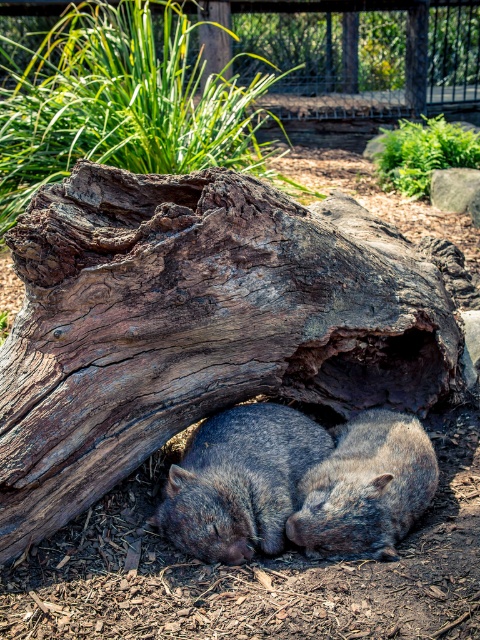
Consider the image. Measure the distance between fuzzy gray wombat at center and gray furry wombat at center.

fuzzy gray wombat at center is 10.03 inches away from gray furry wombat at center.

Between fuzzy gray wombat at center and gray furry wombat at center, which one has less height?

With less height is gray furry wombat at center.

Who is more distant from viewer, (173, 493) or (355, 468)?

The point (355, 468) is behind.

Where is `fuzzy gray wombat at center`? The image size is (480, 640). fuzzy gray wombat at center is located at coordinates (240, 481).

Who is more distant from viewer, (444,289) or (288,429)?

Point (444,289)

You are a GUI agent. You are given a task and a screenshot of the screen. Output one action in this format:
    pyautogui.click(x=<x>, y=<y>)
    Task: Click on the gray rough bark tree trunk at center
    
    Given the screenshot: What is the action you would take?
    pyautogui.click(x=196, y=323)

Who is higher up, gray rough bark tree trunk at center or gray furry wombat at center?

gray rough bark tree trunk at center is higher up.

At what (x,y) coordinates should I click in order to perform the action: click on gray rough bark tree trunk at center. Please return your answer as a coordinate pair (x, y). This screenshot has height=640, width=480. Looking at the image, I should click on (196, 323).

What are the coordinates of `gray rough bark tree trunk at center` in the screenshot? It's located at (196, 323).